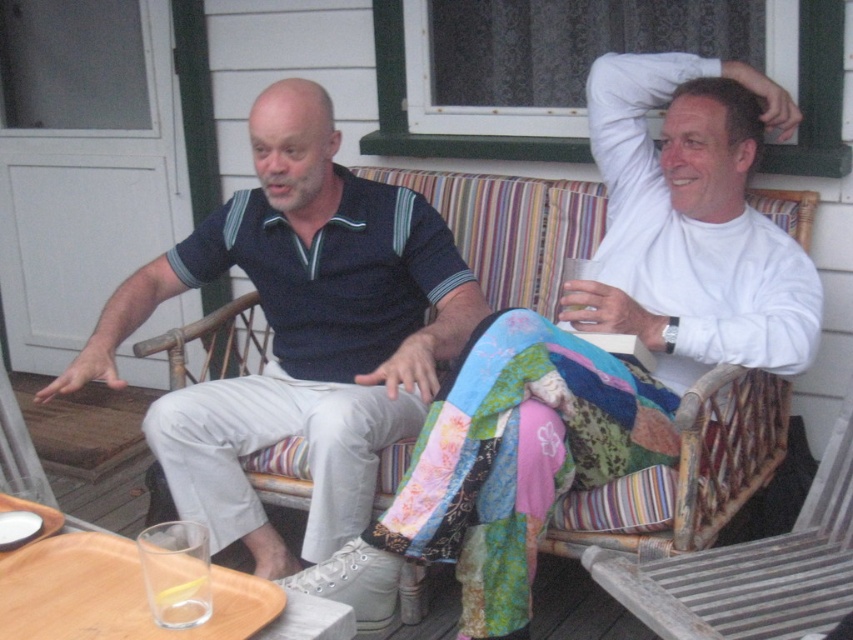
You are standing in front of the porch scene. There is a point marked at coordinates (300, 332). Which object does this point correspond to?

The point at coordinates (300, 332) corresponds to the dark blue polo shirt at center.

You are standing in front of the porch and want to approach the dark blue polo shirt at center and the wooden slats rocking chair at lower right. Which object will you encounter first as you walk towards them?

The dark blue polo shirt at center is closer to you than the wooden slats rocking chair at lower right, so you will encounter the dark blue polo shirt at center first.